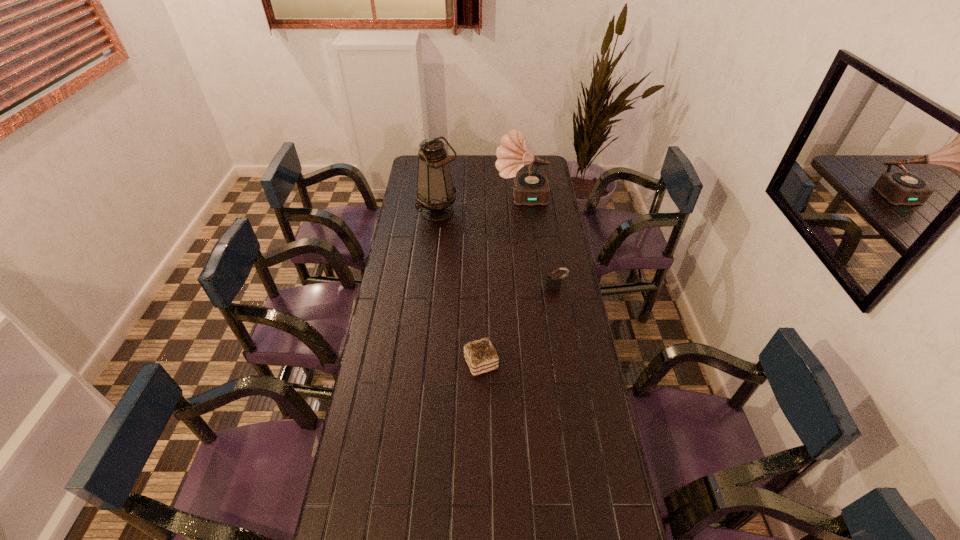
You are a GUI agent. You are given a task and a screenshot of the screen. Output one action in this format:
    pyautogui.click(x=<x>, y=<y>)
    Task: Click on the free point between the second nearest object and the third object from right to left
    The height and width of the screenshot is (540, 960).
    Given the screenshot: What is the action you would take?
    pyautogui.click(x=518, y=325)

Image resolution: width=960 pixels, height=540 pixels. In order to click on free space between the record player and the oil lamp in this screenshot , I will do (480, 205).

The width and height of the screenshot is (960, 540). What are the coordinates of `unoccupied position between the shortest object and the oil lamp` in the screenshot? It's located at (460, 287).

You are a GUI agent. You are given a task and a screenshot of the screen. Output one action in this format:
    pyautogui.click(x=<x>, y=<y>)
    Task: Click on the empty space between the chocolate cake and the leftmost object
    The width and height of the screenshot is (960, 540).
    Given the screenshot: What is the action you would take?
    pyautogui.click(x=460, y=287)

Identify the location of free space that is in between the shortest object and the third farthest object. Image resolution: width=960 pixels, height=540 pixels. (518, 325).

Locate an element on the screen. vacant area that lies between the leftmost object and the nearest object is located at coordinates (460, 287).

In order to click on vacant space that's between the record player and the leftmost object in this screenshot , I will do `click(480, 205)`.

Where is `free space between the leftmost object and the nearest object`? The height and width of the screenshot is (540, 960). free space between the leftmost object and the nearest object is located at coordinates (460, 287).

Where is `object that is the second closest to the chocolate cake`? Image resolution: width=960 pixels, height=540 pixels. object that is the second closest to the chocolate cake is located at coordinates (435, 195).

Identify which object is the second closest to the leftmost object. Please provide its 2D coordinates. Your answer should be formatted as a tuple, i.e. [(x, y)], where the tuple contains the x and y coordinates of a point satisfying the conditions above.

[(553, 282)]